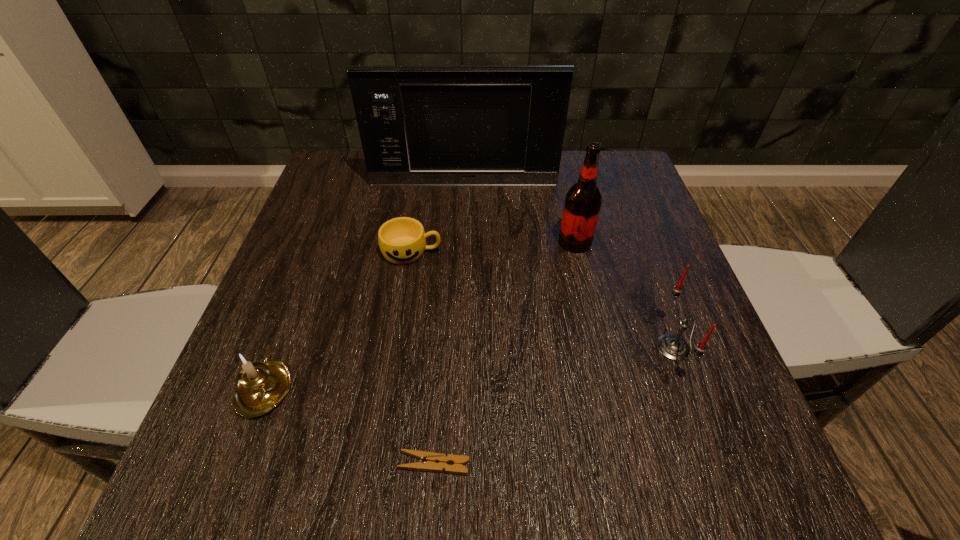
You are a GUI agent. You are given a task and a screenshot of the screen. Output one action in this format:
    pyautogui.click(x=<x>, y=<y>)
    Task: Click on the object that is at the far edge
    
    Given the screenshot: What is the action you would take?
    pyautogui.click(x=475, y=125)

You are a GUI agent. You are given a task and a screenshot of the screen. Output one action in this format:
    pyautogui.click(x=<x>, y=<y>)
    Task: Click on the object at the near edge
    
    Given the screenshot: What is the action you would take?
    pyautogui.click(x=431, y=458)

This screenshot has width=960, height=540. In order to click on microwave oven located in the left edge section of the desktop in this screenshot , I will do pyautogui.click(x=475, y=125).

The height and width of the screenshot is (540, 960). In order to click on candle holder situated at the left edge in this screenshot , I will do `click(263, 385)`.

Find the location of a particular element. root beer located at the right edge is located at coordinates (583, 200).

Locate an element on the screen. The image size is (960, 540). candle that is at the right edge is located at coordinates (673, 347).

Locate an element on the screen. object that is positioned at the far left corner is located at coordinates (475, 125).

The image size is (960, 540). Find the location of `vacant space at the far edge of the desktop`. vacant space at the far edge of the desktop is located at coordinates (564, 198).

Where is `vacant space at the left edge`? vacant space at the left edge is located at coordinates (242, 416).

At what (x,y) coordinates should I click in order to perform the action: click on vacant region at the right edge of the desktop. Please return your answer as a coordinate pair (x, y). Looking at the image, I should click on (599, 270).